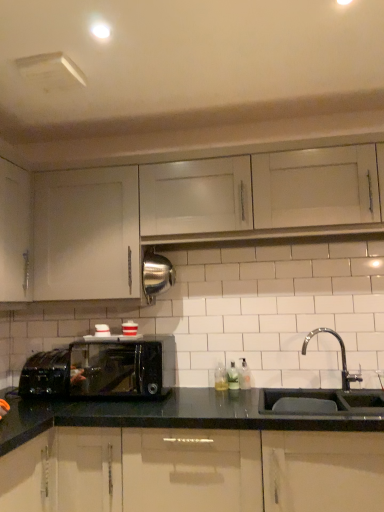
Find the location of `vacant space to the left of translucent plastic soap at center, which is the 1th bottle in left-to-right order`. vacant space to the left of translucent plastic soap at center, which is the 1th bottle in left-to-right order is located at coordinates (187, 391).